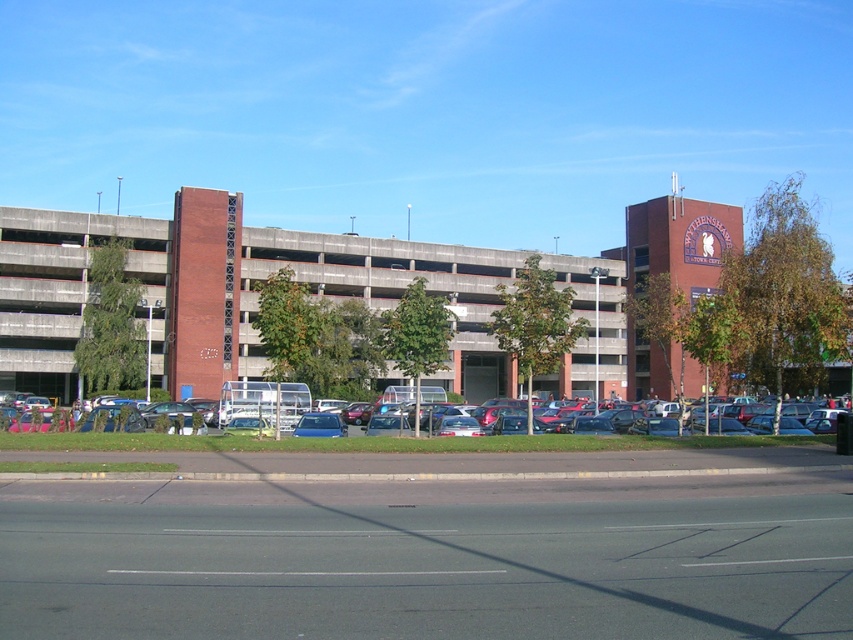
Question: Does asphalt at lower center have a smaller size compared to metallic silver car at center?

Choices:
 (A) yes
 (B) no

Answer: (A)

Question: Which object appears closest to the camera in this image?

Choices:
 (A) asphalt at lower center
 (B) metallic silver car at center

Answer: (A)

Question: Is asphalt at lower center closer to camera compared to metallic silver car at center?

Choices:
 (A) yes
 (B) no

Answer: (A)

Question: Which point is farther to the camera?

Choices:
 (A) metallic silver car at center
 (B) asphalt at lower center

Answer: (A)

Question: Can you confirm if asphalt at lower center is bigger than metallic silver car at center?

Choices:
 (A) no
 (B) yes

Answer: (A)